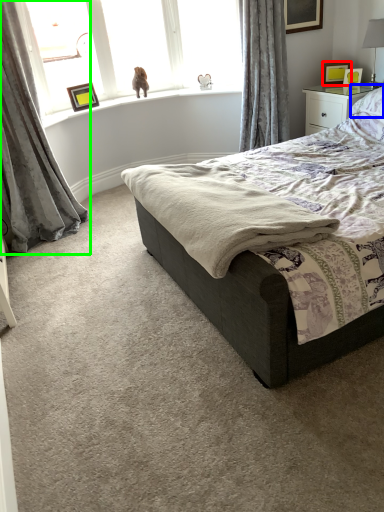
Question: Estimate the real-world distances between objects in this image. Which object is farther from picture frame (highlighted by a red box), pillow (highlighted by a blue box) or curtain (highlighted by a green box)?

Choices:
 (A) pillow
 (B) curtain

Answer: (B)